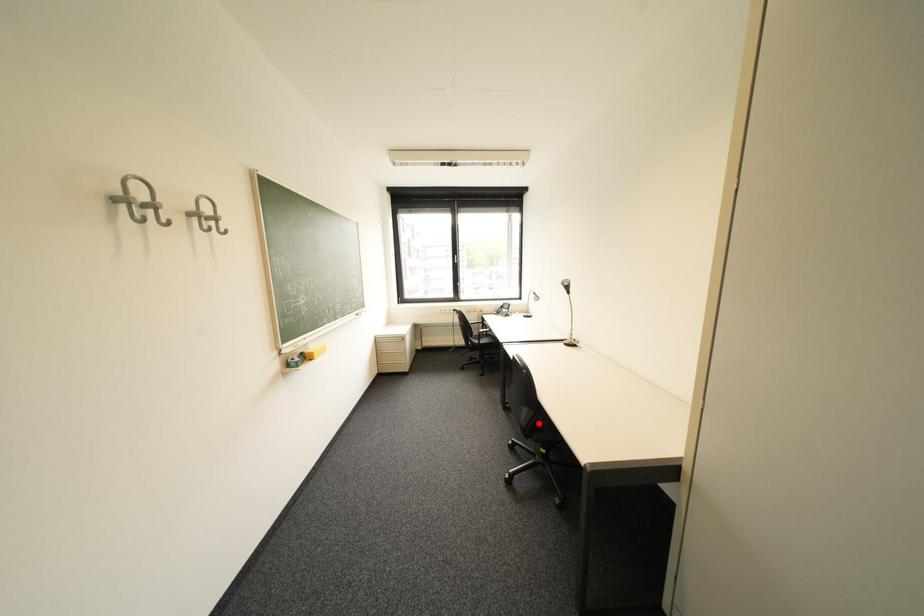
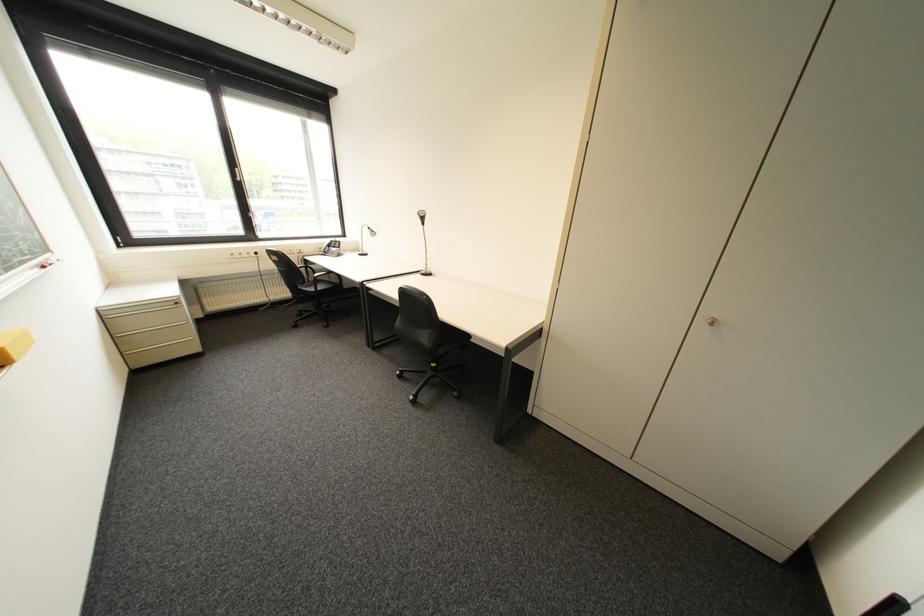
Question: A red point is marked in image1. In image2, is the corresponding 3D point closer to the camera or farther? Reply with the corresponding letter.

Choices:
 (A) The corresponding 3D point is closer.
 (B) The corresponding 3D point is farther.

Answer: (B)